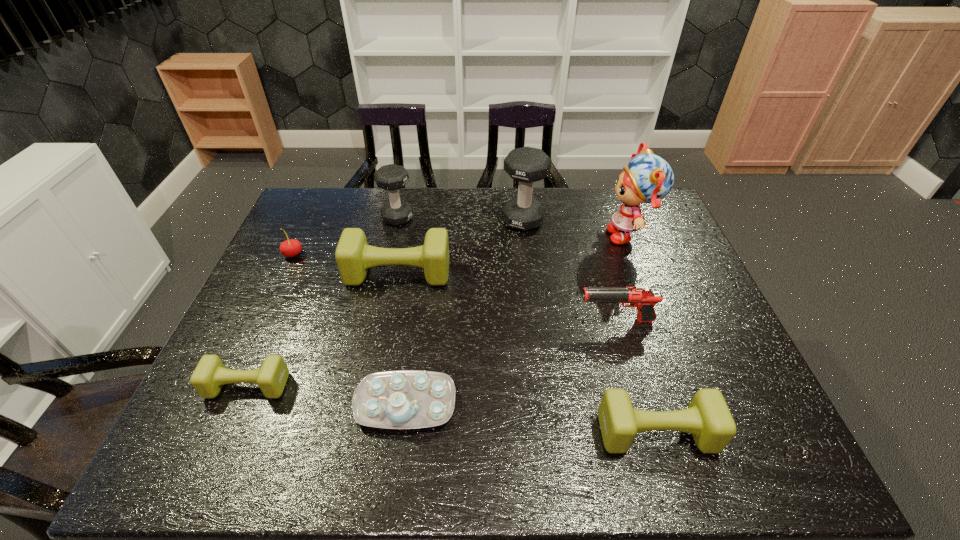
This screenshot has height=540, width=960. In order to click on chinaware present at the near edge in this screenshot , I will do `click(404, 399)`.

Where is `cherry that is at the left edge`? The width and height of the screenshot is (960, 540). cherry that is at the left edge is located at coordinates (290, 248).

In order to click on dumbbell at the left edge in this screenshot , I will do `click(209, 376)`.

Image resolution: width=960 pixels, height=540 pixels. I want to click on doll present at the right edge, so [x=648, y=178].

Where is `dumbbell situated at the right edge`? dumbbell situated at the right edge is located at coordinates (707, 417).

In order to click on object positioned at the far right corner in this screenshot , I will do `click(648, 178)`.

Where is `object that is at the near right corner`? object that is at the near right corner is located at coordinates (707, 417).

Locate an element on the screen. Image resolution: width=960 pixels, height=540 pixels. vacant space at the far edge of the desktop is located at coordinates (365, 197).

The height and width of the screenshot is (540, 960). What are the coordinates of `blank space at the near edge of the desktop` in the screenshot? It's located at (623, 453).

Identify the location of vacant space at the left edge of the desktop. This screenshot has height=540, width=960. (225, 403).